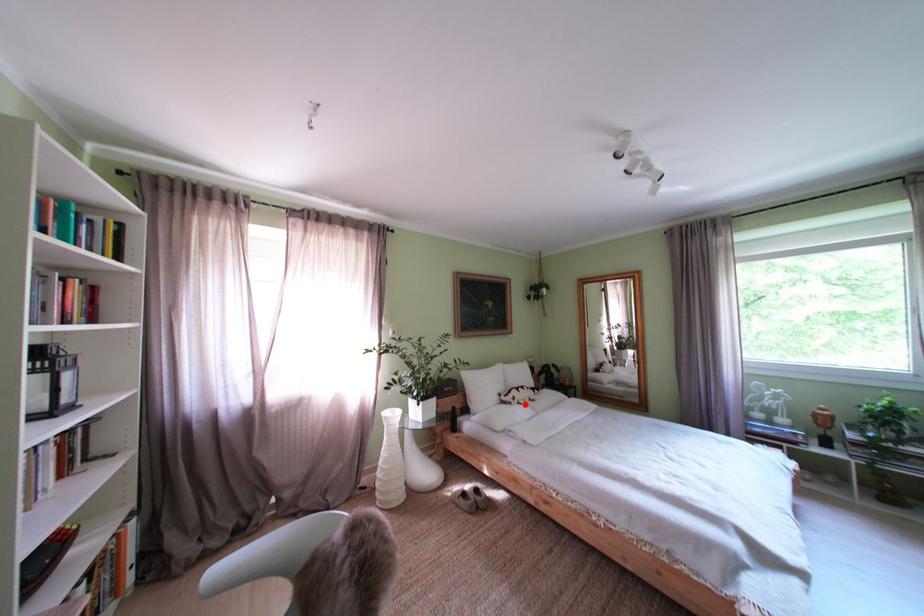
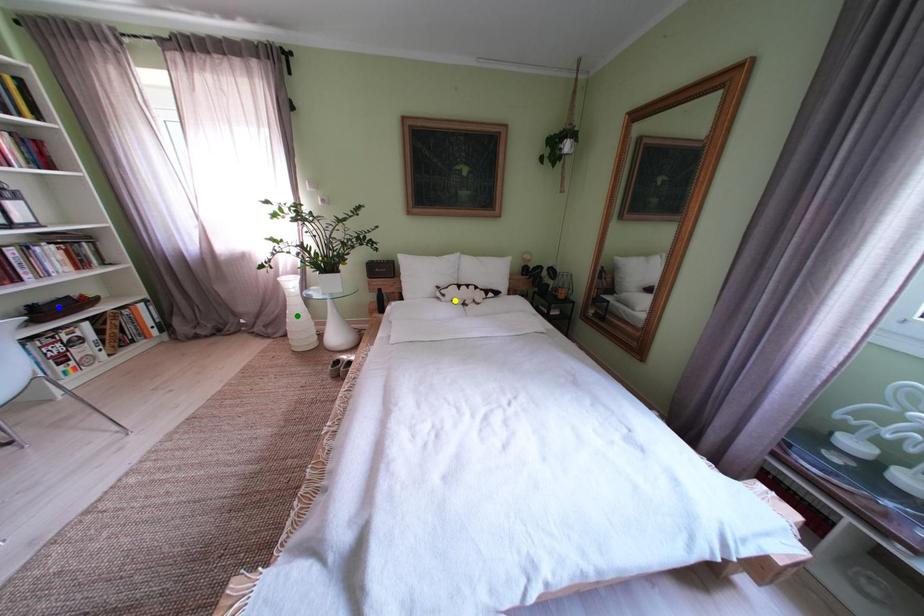
Question: I am providing you with two images of the same scene from different viewpoints. A red point is marked on the first image. You are given multiple points on the second image. Which spot in image 2 lines up with the point in image 1?

Choices:
 (A) yellow point
 (B) green point
 (C) blue point

Answer: (A)